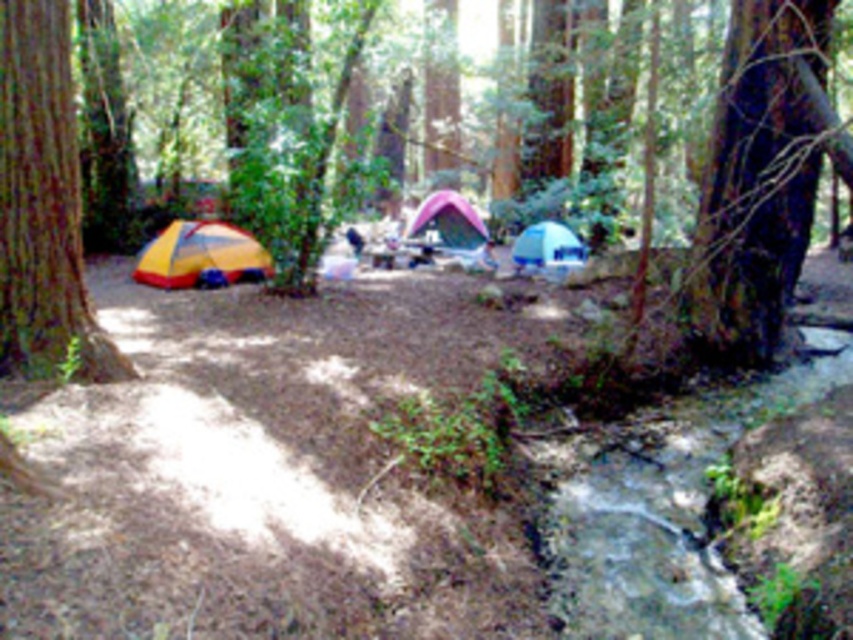
Which is more to the left, brown rough bark tree at center right or yellow/red fabric tent at left?

Positioned to the left is yellow/red fabric tent at left.

Is point (769, 316) positioned after point (225, 244)?

No, (769, 316) is closer to viewer.

What are the coordinates of `brown rough bark tree at center right` in the screenshot? It's located at (756, 179).

Identify the location of brown rough bark tree at center right. The width and height of the screenshot is (853, 640). (756, 179).

Between yellow/red fabric tent at left and pink fabric tent at center, which one appears on the left side from the viewer's perspective?

Positioned to the left is yellow/red fabric tent at left.

Who is taller, yellow/red fabric tent at left or pink fabric tent at center?

Standing taller between the two is pink fabric tent at center.

Consider the image. Who is more distant from viewer, (236, 260) or (461, 243)?

The point (461, 243) is behind.

The image size is (853, 640). In order to click on yellow/red fabric tent at left in this screenshot , I will do `click(200, 253)`.

Does yellow/red fabric tent at left have a smaller size compared to blue tarpaulin tent at center?

Actually, yellow/red fabric tent at left might be larger than blue tarpaulin tent at center.

The image size is (853, 640). Identify the location of yellow/red fabric tent at left. (200, 253).

Where is `yellow/red fabric tent at left`? yellow/red fabric tent at left is located at coordinates (200, 253).